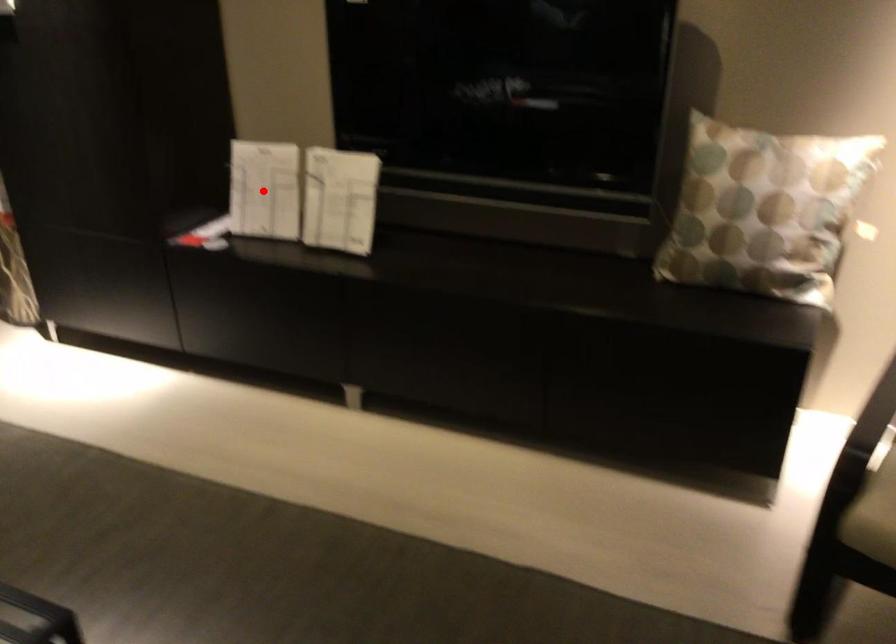
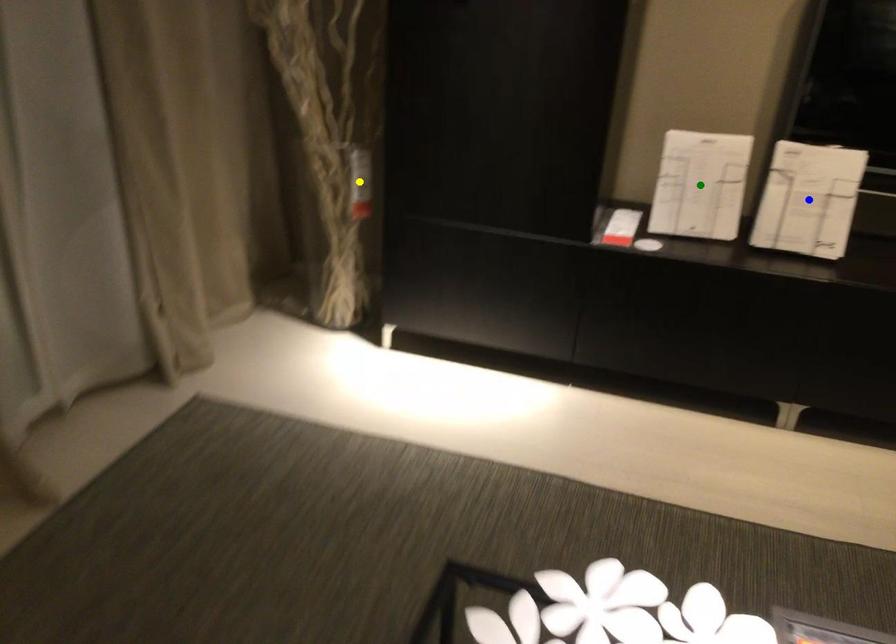
Question: I am providing you with two images of the same scene from different viewpoints. A red point is marked on the first image. You are given multiple points on the second image. Which spot in image 2 lines up with the point in image 1?

Choices:
 (A) yellow point
 (B) green point
 (C) blue point

Answer: (B)